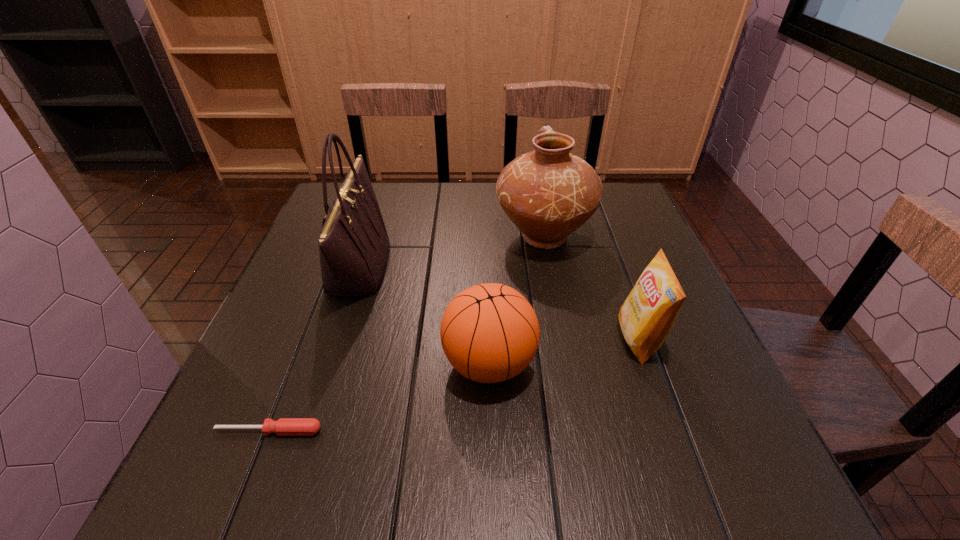
Find the location of a particular element. free spot that satisfies the following two spatial constraints: 1. on the front-facing side of the basketball; 2. on the right side of the tallest object is located at coordinates (327, 363).